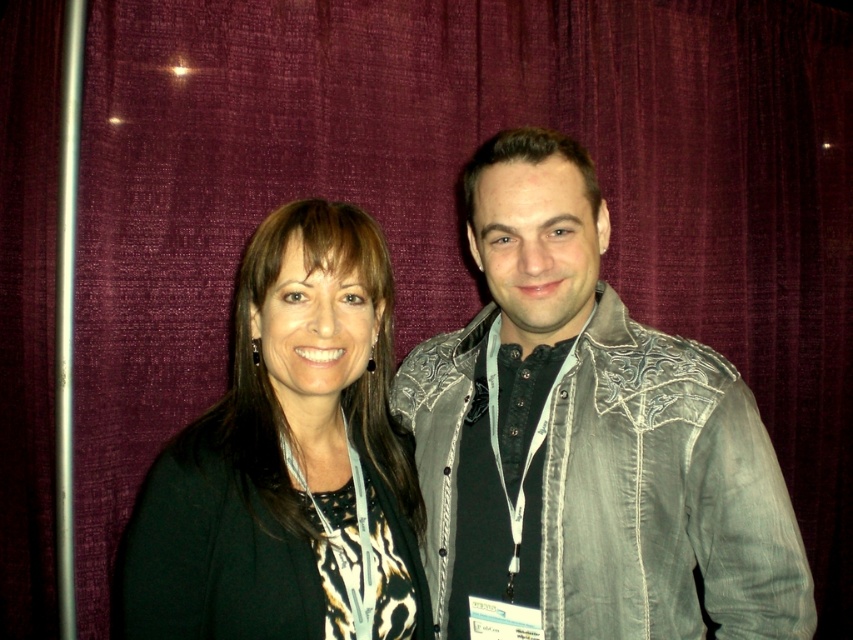
Which of these two, denim jacket at center or black matte jacket at center, stands shorter?

black matte jacket at center is shorter.

The width and height of the screenshot is (853, 640). In order to click on denim jacket at center in this screenshot , I will do `click(587, 440)`.

Identify the location of denim jacket at center. The image size is (853, 640). (587, 440).